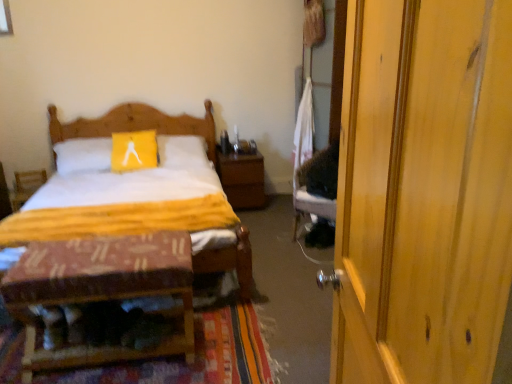
Question: Is wooden patterned stool at lower left to the left of wooden bed at center from the viewer's perspective?

Choices:
 (A) yes
 (B) no

Answer: (B)

Question: Is wooden patterned stool at lower left located outside wooden bed at center?

Choices:
 (A) yes
 (B) no

Answer: (A)

Question: Is wooden patterned stool at lower left looking in the opposite direction of wooden bed at center?

Choices:
 (A) no
 (B) yes

Answer: (B)

Question: Considering the relative sizes of wooden patterned stool at lower left and wooden bed at center in the image provided, is wooden patterned stool at lower left wider than wooden bed at center?

Choices:
 (A) yes
 (B) no

Answer: (B)

Question: Considering the relative sizes of wooden patterned stool at lower left and wooden bed at center in the image provided, is wooden patterned stool at lower left shorter than wooden bed at center?

Choices:
 (A) yes
 (B) no

Answer: (A)

Question: Is wooden patterned stool at lower left next to wooden bed at center and touching it?

Choices:
 (A) yes
 (B) no

Answer: (B)

Question: Is wooden patterned stool at lower left positioned with its back to wooden nightstand at center?

Choices:
 (A) yes
 (B) no

Answer: (A)

Question: Considering the relative positions of wooden patterned stool at lower left and wooden nightstand at center in the image provided, is wooden patterned stool at lower left behind wooden nightstand at center?

Choices:
 (A) no
 (B) yes

Answer: (A)

Question: Is wooden patterned stool at lower left to the left of wooden nightstand at center from the viewer's perspective?

Choices:
 (A) no
 (B) yes

Answer: (B)

Question: Does wooden patterned stool at lower left have a lesser width compared to wooden nightstand at center?

Choices:
 (A) no
 (B) yes

Answer: (B)

Question: Can you confirm if wooden patterned stool at lower left is shorter than wooden nightstand at center?

Choices:
 (A) no
 (B) yes

Answer: (B)

Question: Can you confirm if wooden patterned stool at lower left is wider than wooden nightstand at center?

Choices:
 (A) yes
 (B) no

Answer: (B)

Question: Considering the relative sizes of textured woolen mat at lower left and wooden armchair at left in the image provided, is textured woolen mat at lower left taller than wooden armchair at left?

Choices:
 (A) no
 (B) yes

Answer: (A)